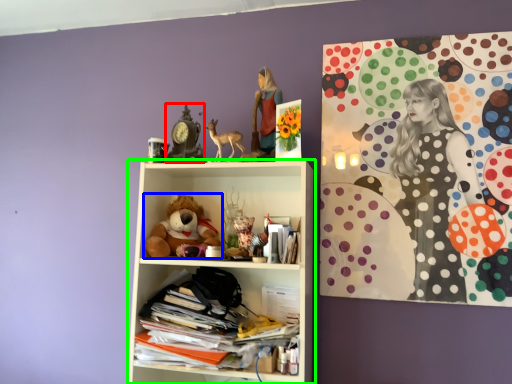
Question: Estimate the real-world distances between objects in this image. Which object is closer to art (highlighted by a red box), teddy bear (highlighted by a blue box) or shelf (highlighted by a green box)?

Choices:
 (A) teddy bear
 (B) shelf

Answer: (A)